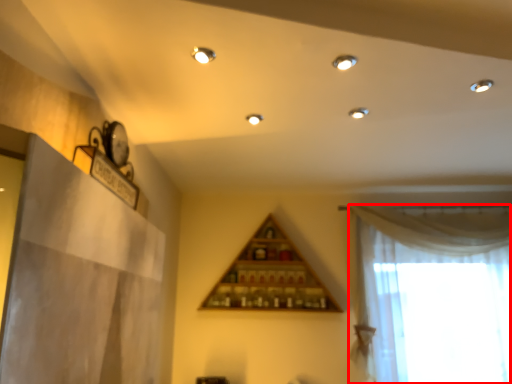
Question: From the image, what is the correct spatial relationship of curtain (annotated by the red box) in relation to shelf?

Choices:
 (A) left
 (B) right

Answer: (B)